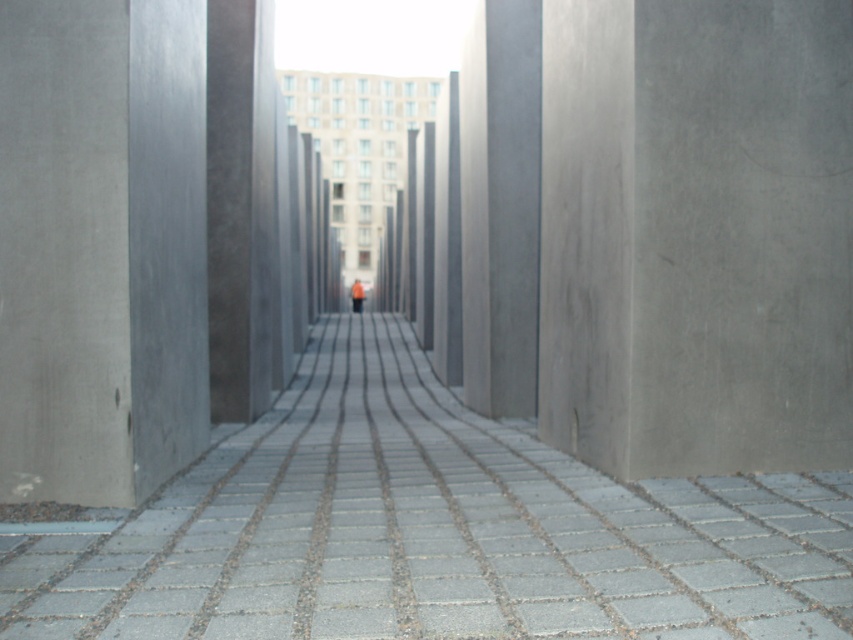
You are standing at the entrance of the architectural structure and want to walk towards the large building in the background. Since you need to step on the gray concrete pavement at center and the orange fabric person at center, which object will you step on first?

The orange fabric person at center will be stepped on first because the gray concrete pavement at center is wider, but since both are at the center, the person is likely closer to the entrance than the pavement.